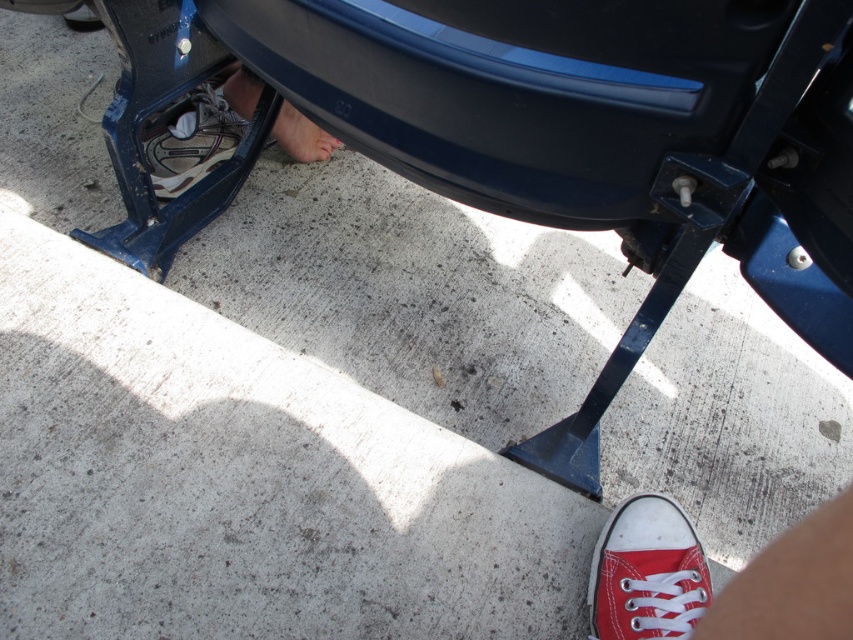
Question: Is red canvas shoe at lower right bigger than smooth skin foot at center?

Choices:
 (A) no
 (B) yes

Answer: (A)

Question: Which is nearer to the smooth skin foot at center?

Choices:
 (A) red canvas shoe at lower right
 (B) leather/textured sneaker at lower left

Answer: (B)

Question: Is leather/textured sneaker at lower left bigger than smooth skin foot at center?

Choices:
 (A) no
 (B) yes

Answer: (B)

Question: Which object is farther from the camera taking this photo?

Choices:
 (A) leather/textured sneaker at lower left
 (B) smooth skin foot at center

Answer: (B)

Question: Is leather/textured sneaker at lower left positioned in front of smooth skin foot at center?

Choices:
 (A) yes
 (B) no

Answer: (A)

Question: Estimate the real-world distances between objects in this image. Which object is farther from the smooth skin foot at center?

Choices:
 (A) leather/textured sneaker at lower left
 (B) red canvas shoe at lower right

Answer: (B)